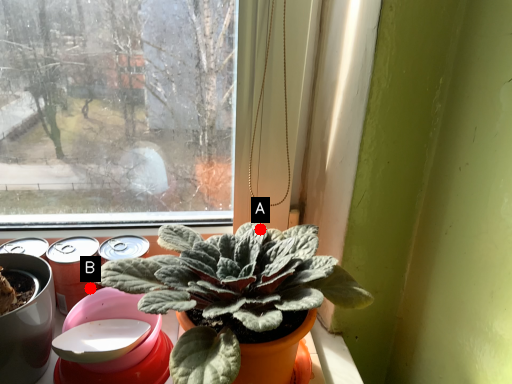
Question: Two points are circled on the image, labeled by A and B beside each circle. Which point is farther from the camera taking this photo?

Choices:
 (A) A is further
 (B) B is further

Answer: (B)